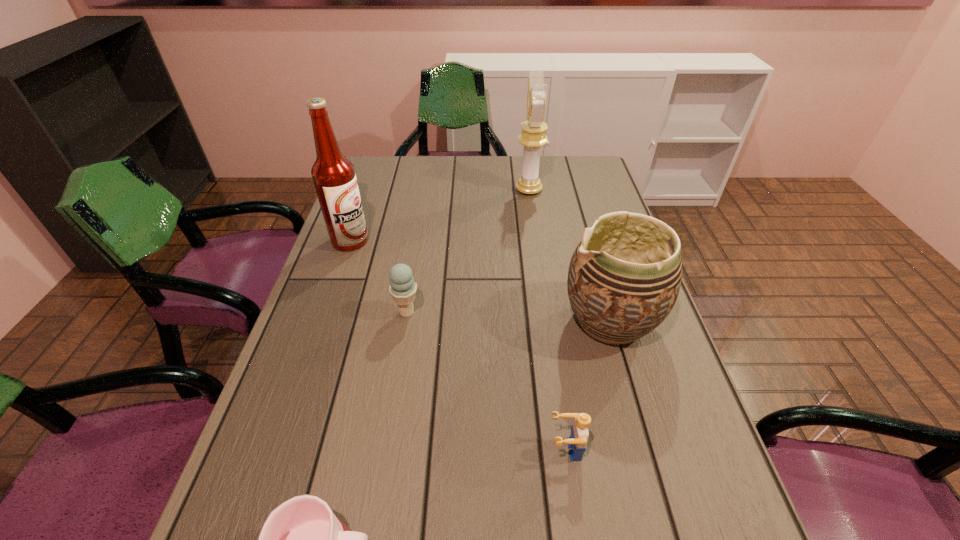
Select which object is the closest to the second shortest object. Please provide its 2D coordinates. Your answer should be formatted as a tuple, i.e. [(x, y)], where the tuple contains the x and y coordinates of a point satisfying the conditions above.

[(622, 283)]

At what (x,y) coordinates should I click in order to perform the action: click on object that is the fifth closest to the fourth tallest object. Please return your answer as a coordinate pair (x, y). The height and width of the screenshot is (540, 960). Looking at the image, I should click on (533, 137).

The height and width of the screenshot is (540, 960). What are the coordinates of `blank space that satisfies the following two spatial constraints: 1. on the back side of the fourth shortest object; 2. on the label side of the alcohol` in the screenshot? It's located at (588, 241).

Locate an element on the screen. The image size is (960, 540). free space that satisfies the following two spatial constraints: 1. on the front-facing side of the farthest object; 2. on the right side of the fourth shortest object is located at coordinates (548, 321).

You are a GUI agent. You are given a task and a screenshot of the screen. Output one action in this format:
    pyautogui.click(x=<x>, y=<y>)
    Task: Click on the free location that satisfies the following two spatial constraints: 1. on the label side of the alcohol; 2. on the right side of the pottery
    This screenshot has height=540, width=960.
    Given the screenshot: What is the action you would take?
    pyautogui.click(x=323, y=321)

Locate an element on the screen. The height and width of the screenshot is (540, 960). free space that satisfies the following two spatial constraints: 1. on the label side of the ice cream; 2. on the right side of the alcohol is located at coordinates (325, 313).

Find the location of a particular element. This screenshot has width=960, height=540. free location that satisfies the following two spatial constraints: 1. on the back side of the third tallest object; 2. on the label side of the alcohol is located at coordinates (588, 241).

Identify the location of free space that satisfies the following two spatial constraints: 1. on the front-facing side of the third tallest object; 2. on the left side of the award. The height and width of the screenshot is (540, 960). (548, 321).

Find the location of a particular element. free region that satisfies the following two spatial constraints: 1. on the front-facing side of the farthest object; 2. on the left side of the pottery is located at coordinates (548, 321).